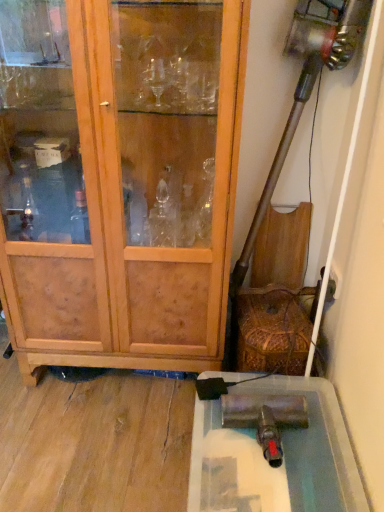
Question: Is there a large distance between metallic silver cabinet at lower right and wooden cabinet at left?

Choices:
 (A) yes
 (B) no

Answer: (B)

Question: Does metallic silver cabinet at lower right lie behind wooden cabinet at left?

Choices:
 (A) no
 (B) yes

Answer: (B)

Question: Is metallic silver cabinet at lower right at the left side of wooden cabinet at left?

Choices:
 (A) no
 (B) yes

Answer: (A)

Question: From a real-world perspective, is metallic silver cabinet at lower right beneath wooden cabinet at left?

Choices:
 (A) no
 (B) yes

Answer: (B)

Question: From the image's perspective, is metallic silver cabinet at lower right on wooden cabinet at left?

Choices:
 (A) yes
 (B) no

Answer: (B)

Question: Is metallic silver cabinet at lower right thinner than wooden cabinet at left?

Choices:
 (A) no
 (B) yes

Answer: (A)

Question: Would you consider wooden cabinet at left to be distant from metallic silver cabinet at lower right?

Choices:
 (A) no
 (B) yes

Answer: (A)

Question: Considering the relative sizes of wooden cabinet at left and metallic silver cabinet at lower right in the image provided, is wooden cabinet at left thinner than metallic silver cabinet at lower right?

Choices:
 (A) no
 (B) yes

Answer: (B)

Question: From the image's perspective, is wooden cabinet at left under metallic silver cabinet at lower right?

Choices:
 (A) no
 (B) yes

Answer: (A)

Question: Is wooden cabinet at left further to the viewer compared to metallic silver cabinet at lower right?

Choices:
 (A) yes
 (B) no

Answer: (B)

Question: Can you confirm if wooden cabinet at left is positioned to the right of metallic silver cabinet at lower right?

Choices:
 (A) yes
 (B) no

Answer: (B)

Question: Is wooden cabinet at left facing away from metallic silver cabinet at lower right?

Choices:
 (A) yes
 (B) no

Answer: (B)

Question: From a real-world perspective, is wooden cabinet at left above or below metallic silver cabinet at lower right?

Choices:
 (A) below
 (B) above

Answer: (B)